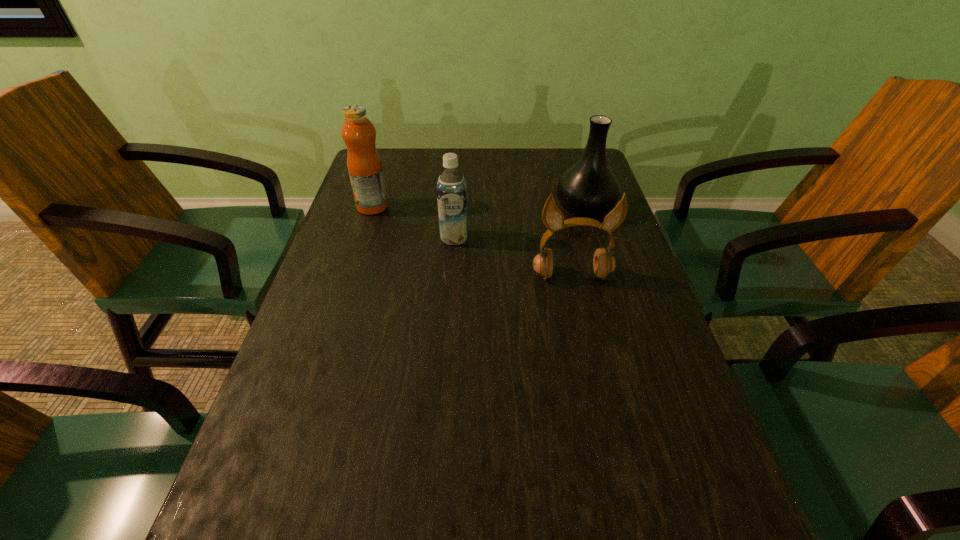
Find the location of a particular element. The width and height of the screenshot is (960, 540). empty space that is in between the soya milk and the fruit juice is located at coordinates (414, 222).

Image resolution: width=960 pixels, height=540 pixels. Find the location of `vacant area that lies between the soya milk and the earphone`. vacant area that lies between the soya milk and the earphone is located at coordinates (513, 256).

Find the location of `free point between the fruit juice and the third farthest object`. free point between the fruit juice and the third farthest object is located at coordinates (414, 222).

Image resolution: width=960 pixels, height=540 pixels. Identify the location of free space between the third farthest object and the nearest object. (513, 256).

Locate an element on the screen. This screenshot has height=540, width=960. empty space that is in between the third object from right to left and the vase is located at coordinates (519, 223).

Select which object appears as the closest to the vase. Please provide its 2D coordinates. Your answer should be formatted as a tuple, i.e. [(x, y)], where the tuple contains the x and y coordinates of a point satisfying the conditions above.

[(604, 263)]

Find the location of a particular element. This screenshot has width=960, height=540. object that is the third closest one to the vase is located at coordinates (364, 164).